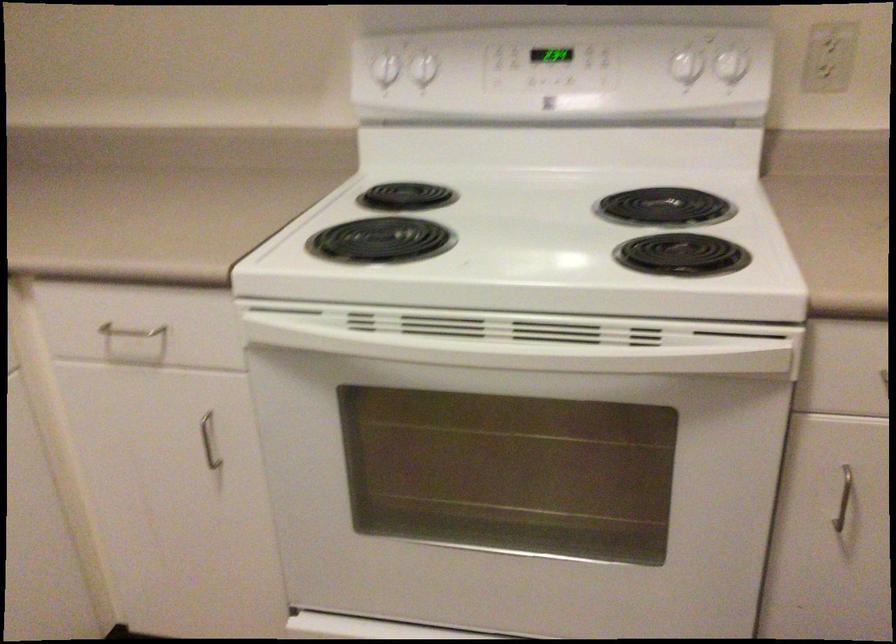
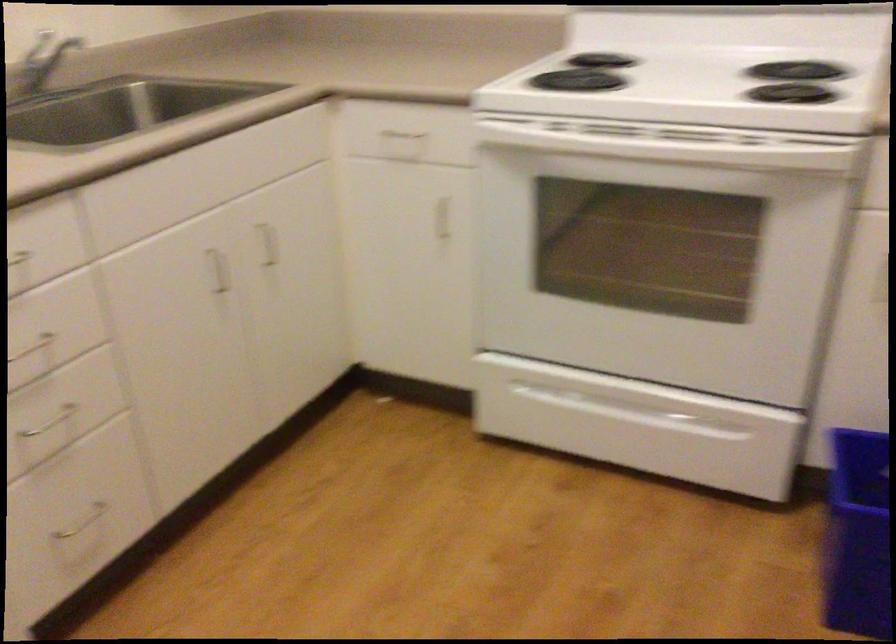
Question: How did the camera likely rotate?

Choices:
 (A) Left
 (B) Right
 (C) Up
 (D) Down

Answer: (A)